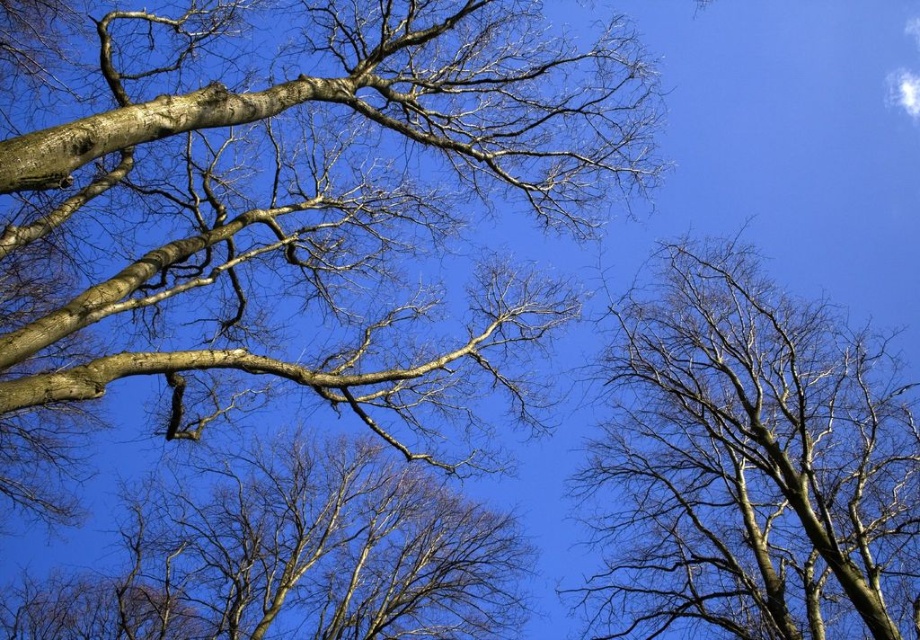
Describe the element at coordinates (277, 188) in the screenshot. I see `smooth bark tree at upper left` at that location.

Locate an element on the screen. smooth bark tree at upper left is located at coordinates (277, 188).

Does point (545, 40) come farther from viewer compared to point (825, 392)?

No, it is in front of (825, 392).

This screenshot has width=920, height=640. I want to click on smooth bark tree at upper left, so click(x=277, y=188).

Who is positioned more to the right, smooth bark tree at upper right or bare branches at center?

Positioned to the right is smooth bark tree at upper right.

Can you confirm if smooth bark tree at upper right is positioned above bare branches at center?

Yes.

Is point (662, 572) closer to camera compared to point (443, 611)?

Yes, point (662, 572) is closer to viewer.

This screenshot has width=920, height=640. What are the coordinates of `smooth bark tree at upper right` in the screenshot? It's located at (752, 467).

Between smooth bark tree at upper left and brown rough bark branch at upper left, which one appears on the left side from the viewer's perspective?

smooth bark tree at upper left

The width and height of the screenshot is (920, 640). What do you see at coordinates (277, 188) in the screenshot? I see `smooth bark tree at upper left` at bounding box center [277, 188].

Identify the location of smooth bark tree at upper left. (277, 188).